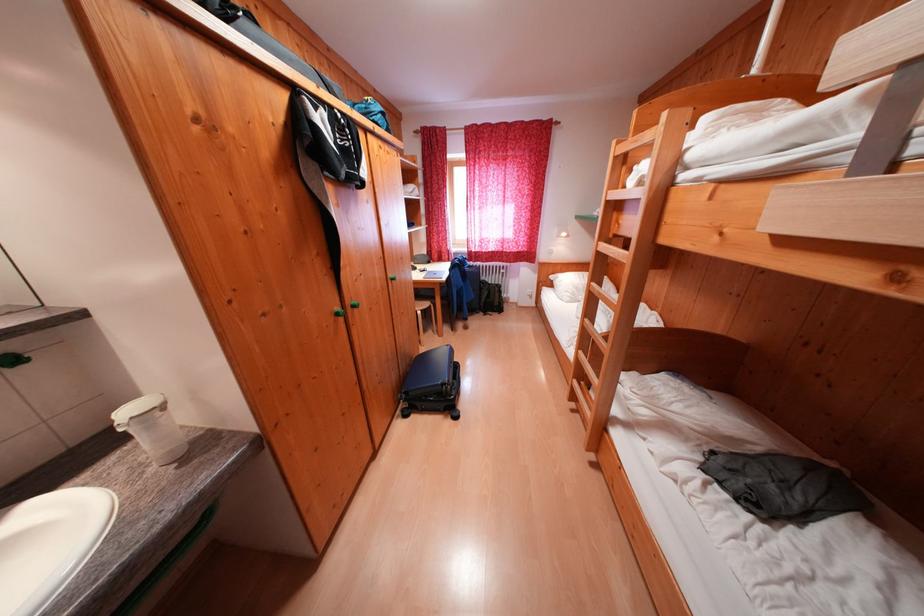
Locate an element on the screen. green backpack is located at coordinates (371, 111).